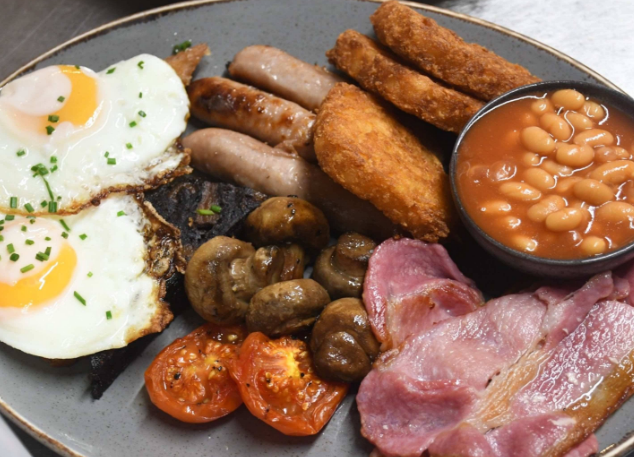
I want to click on table, so click(x=37, y=21).